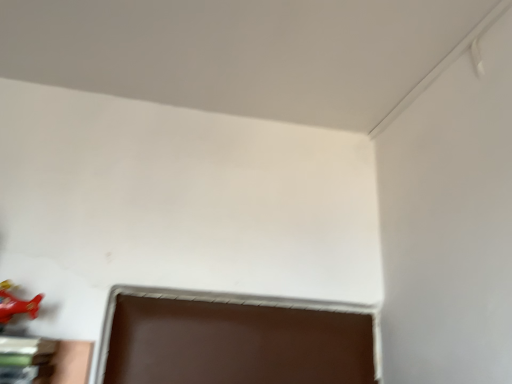
Identify the location of metallic silver tray at lower left. (26, 359).

Describe the element at coordinates (26, 359) in the screenshot. I see `metallic silver tray at lower left` at that location.

Where is `metallic silver tray at lower left`? metallic silver tray at lower left is located at coordinates [x=26, y=359].